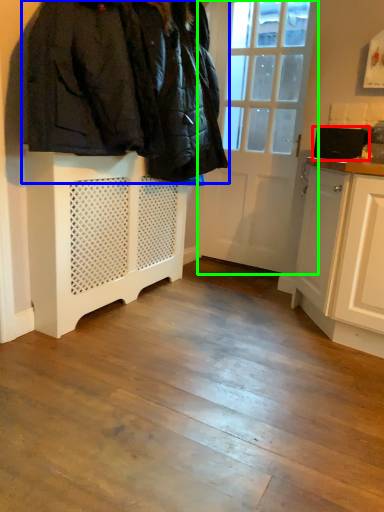
Question: Which is nearer to the appliance (highlighted by a red box)? furniture (highlighted by a blue box) or door (highlighted by a green box).

Choices:
 (A) furniture
 (B) door

Answer: (B)